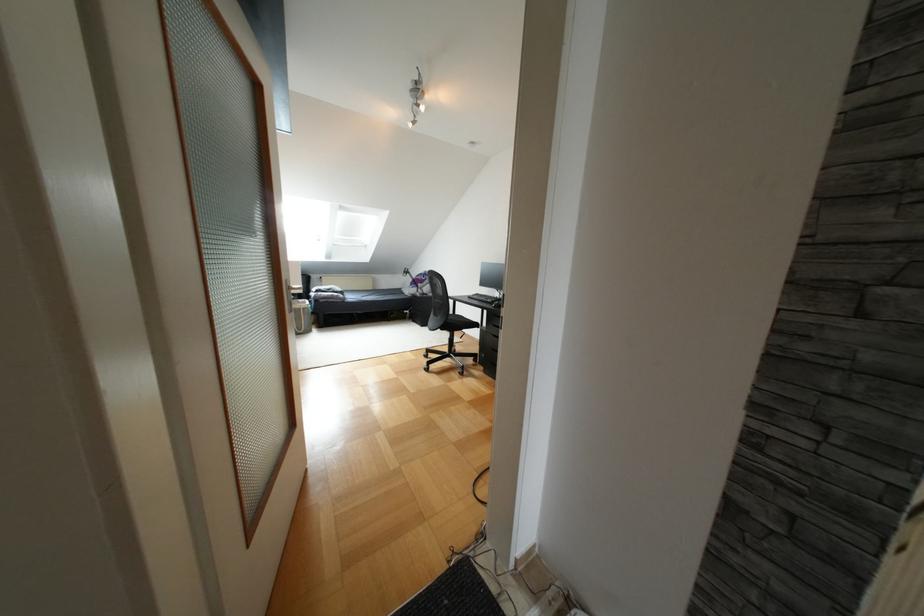
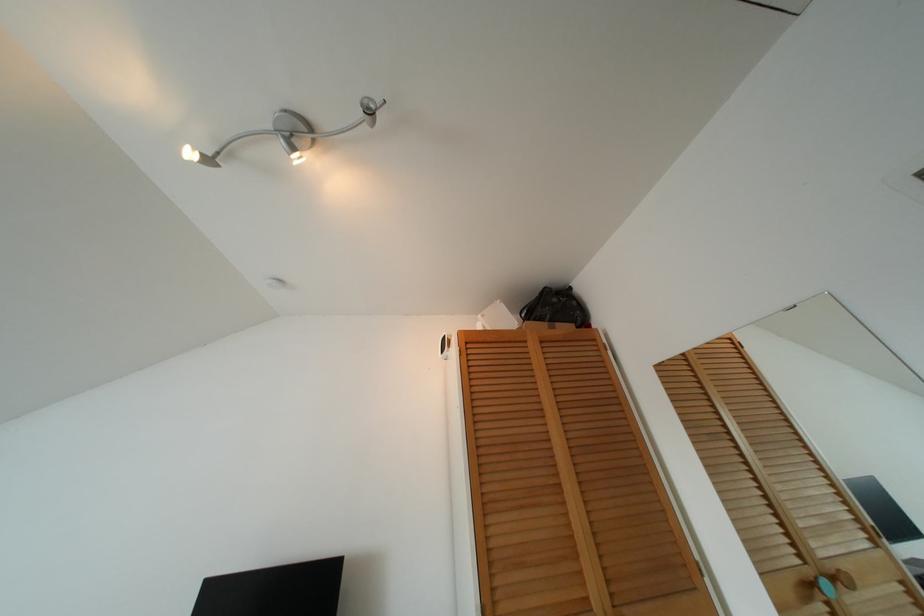
Locate, in the second image, the point that corresponds to pixel 412 122 in the first image.

(208, 160)